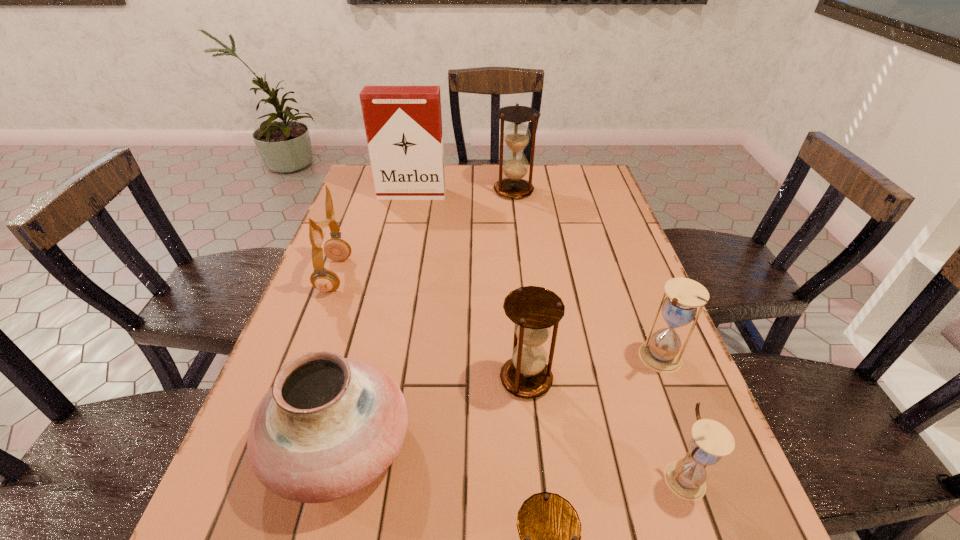
You are a GUI agent. You are given a task and a screenshot of the screen. Output one action in this format:
    pyautogui.click(x=<x>, y=<y>)
    Task: Click on the fourth farthest hourglass
    
    Given the screenshot: What is the action you would take?
    pyautogui.click(x=711, y=440)

Where is `vacant area situated 0.200m on the front-facing side of the red cigarette_case`? The height and width of the screenshot is (540, 960). vacant area situated 0.200m on the front-facing side of the red cigarette_case is located at coordinates (402, 236).

You are a GUI agent. You are given a task and a screenshot of the screen. Output one action in this format:
    pyautogui.click(x=<x>, y=<y>)
    Task: Click on the free region located 0.100m on the back of the biggest brown hourglass
    The image size is (960, 540).
    Given the screenshot: What is the action you would take?
    pyautogui.click(x=511, y=167)

The width and height of the screenshot is (960, 540). I want to click on free space located on the front-facing side of the sixth nearest object, so click(502, 275).

Locate an element on the screen. The width and height of the screenshot is (960, 540). vacant space located 0.200m on the front of the second biggest brown hourglass is located at coordinates (539, 509).

Identify the location of free spot located on the back of the bigger white hourglass. (642, 312).

This screenshot has height=540, width=960. Identify the location of vacant space located on the back of the pottery. (378, 292).

Find the location of a particular element. This screenshot has width=960, height=540. free spot located 0.190m on the back of the smaller white hourglass is located at coordinates (646, 368).

Identify the location of cigarette_case situated at the far edge. (403, 124).

This screenshot has height=540, width=960. Identify the location of hourglass that is at the far edge. (516, 136).